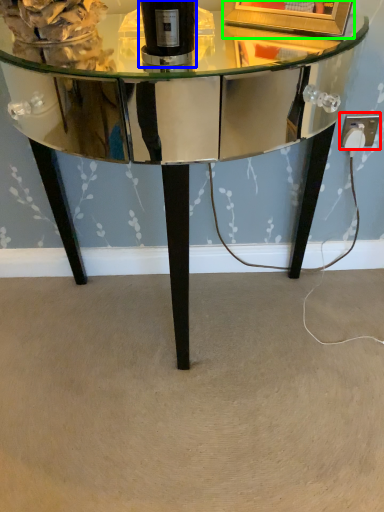
Question: Which object is the farthest from electric outlet (highlighted by a red box)? Choose among these: bottle (highlighted by a blue box) or picture frame (highlighted by a green box).

Choices:
 (A) bottle
 (B) picture frame

Answer: (A)